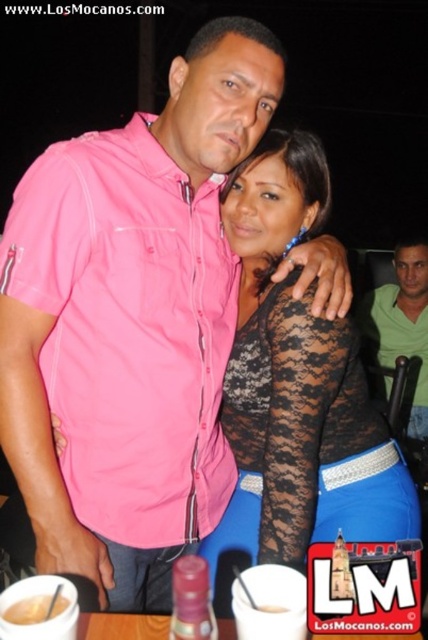
Question: Among these objects, which one is nearest to the camera?

Choices:
 (A) white glossy mug at lower center
 (B) green matte shirt at right

Answer: (A)

Question: Is the position of green matte shirt at right less distant than that of white glossy mug at lower center?

Choices:
 (A) yes
 (B) no

Answer: (B)

Question: Can you confirm if pink cotton shirt at center is thinner than white glossy mug at lower center?

Choices:
 (A) no
 (B) yes

Answer: (B)

Question: Can you confirm if pink cotton shirt at center is positioned to the left of lace fabric top at center?

Choices:
 (A) no
 (B) yes

Answer: (B)

Question: Estimate the real-world distances between objects in this image. Which object is farther from the pink cotton shirt at center?

Choices:
 (A) white glossy mug at lower center
 (B) lace fabric top at center
 (C) green matte shirt at right

Answer: (C)

Question: Which point is farther from the camera taking this photo?

Choices:
 (A) (427, 298)
 (B) (308, 637)
 (C) (158, 316)

Answer: (A)